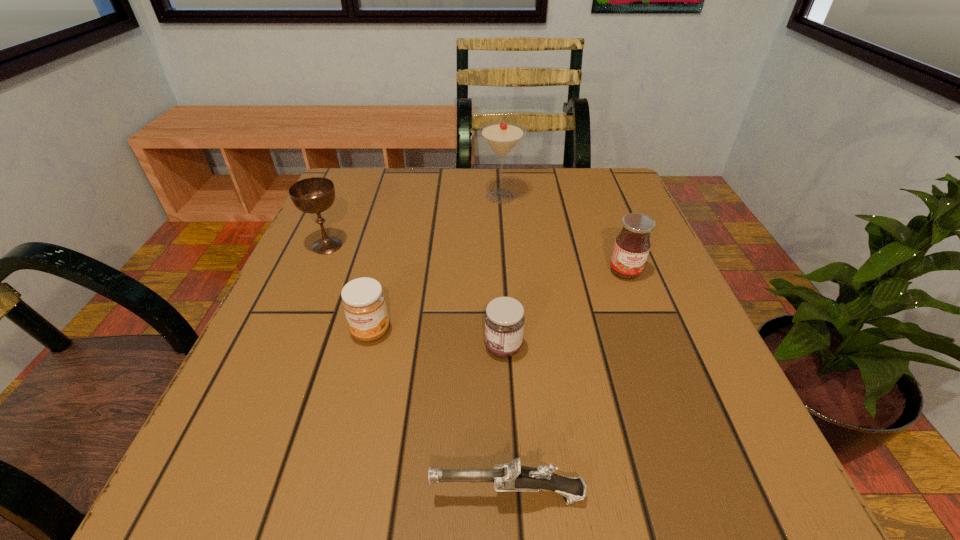
Where is `the tallest object`? The image size is (960, 540). the tallest object is located at coordinates pyautogui.click(x=501, y=136).

This screenshot has height=540, width=960. Identify the location of the farthest object. (501, 136).

You are a GUI agent. You are given a task and a screenshot of the screen. Output one action in this format:
    pyautogui.click(x=<x>, y=<y>)
    Task: Click on the chalice
    
    Given the screenshot: What is the action you would take?
    pyautogui.click(x=312, y=195)

Locate an element on the screen. the leftmost object is located at coordinates click(x=312, y=195).

Locate an element on the screen. The height and width of the screenshot is (540, 960). the tallest jam is located at coordinates (632, 245).

Where is `the rightmost object`? The width and height of the screenshot is (960, 540). the rightmost object is located at coordinates (632, 245).

At what (x,y) coordinates should I click in order to perform the action: click on the leftmost jam. Please return your answer as a coordinate pair (x, y). Looking at the image, I should click on [x=363, y=300].

Where is `the second jam from right to left`? the second jam from right to left is located at coordinates (504, 319).

This screenshot has height=540, width=960. Identify the location of the nearest object. pos(511,477).

At what (x,y) coordinates should I click in order to perform the action: click on vacant space situated on the front of the martini. Please return your answer as a coordinate pair (x, y). This screenshot has width=960, height=540. Looking at the image, I should click on (504, 251).